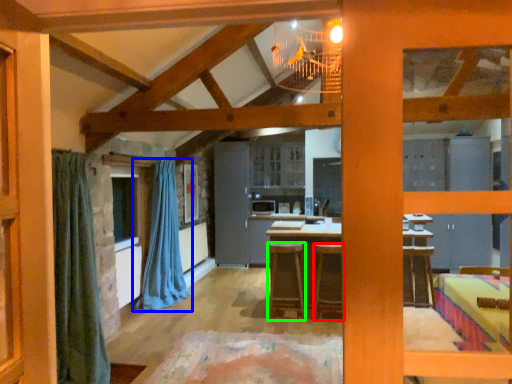
Question: Based on their relative distances, which object is farther from stool (highlighted by a red box)? Choose from curtain (highlighted by a blue box) and stool (highlighted by a green box).

Choices:
 (A) curtain
 (B) stool

Answer: (A)